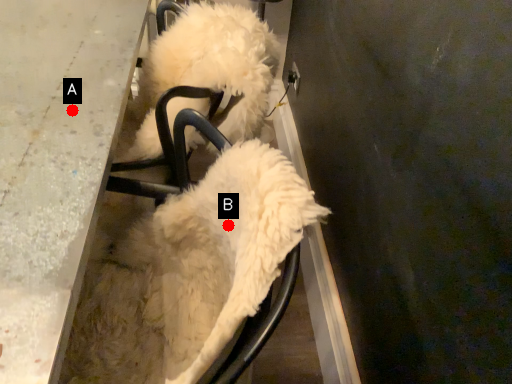
Question: Two points are circled on the image, labeled by A and B beside each circle. Among these points, which one is nearest to the camera?

Choices:
 (A) A is closer
 (B) B is closer

Answer: (B)